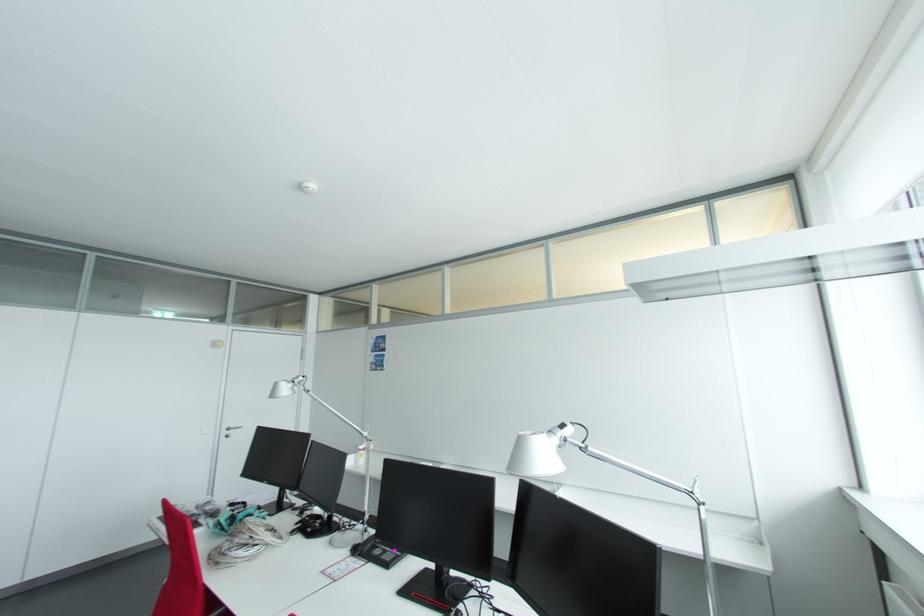
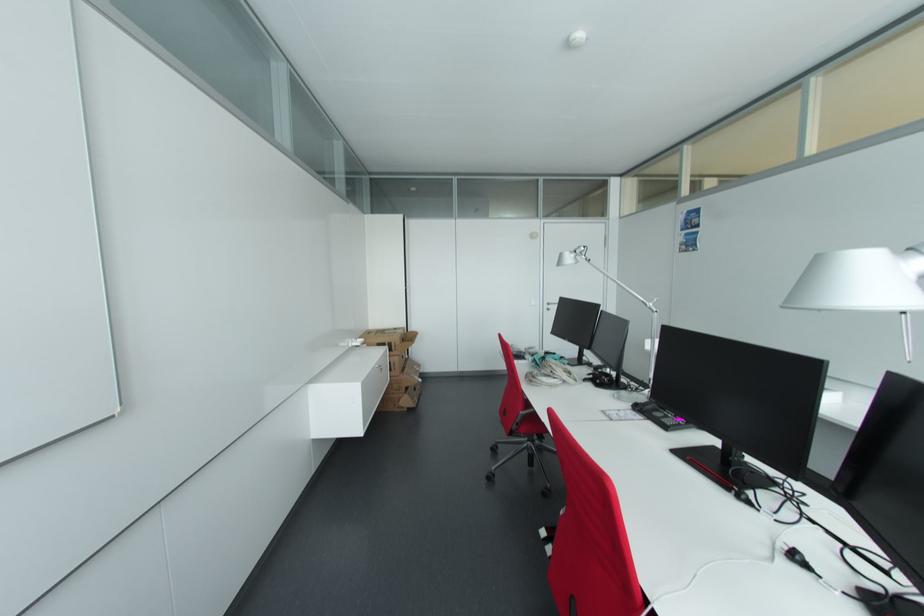
Question: The first image is from the beginning of the video and the second image is from the end. How did the camera likely rotate when shooting the video?

Choices:
 (A) Left
 (B) Right
 (C) Up
 (D) Down

Answer: (A)